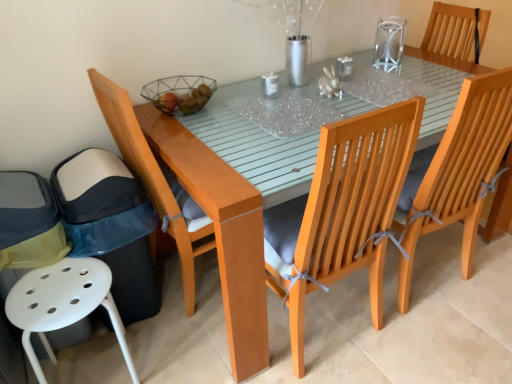
I want to click on blank space to the left of transparent plastic table at center, the 1th glass table viewed from the left, so click(207, 123).